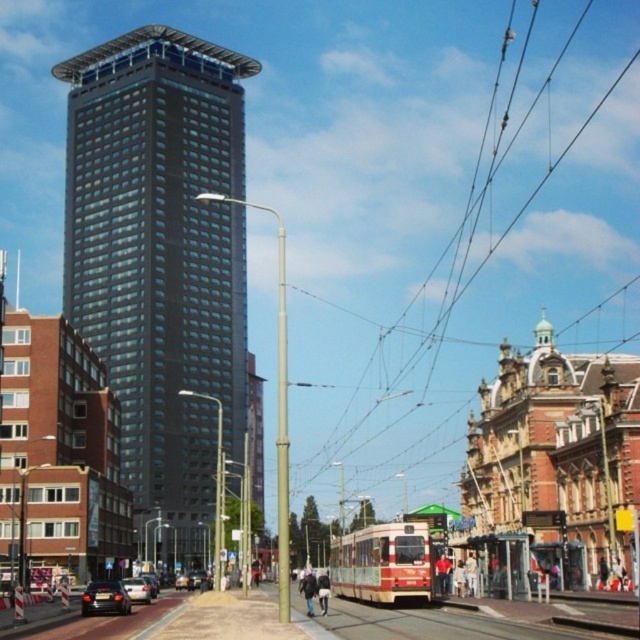
Question: Which object is farther from the camera taking this photo?

Choices:
 (A) silver metallic car at center
 (B) shiny black car at lower left

Answer: (A)

Question: Considering the real-world distances, which object is farthest from the shiny black car at lower left?

Choices:
 (A) matte glass tower at center
 (B) silver metallic car at center

Answer: (A)

Question: Is shiny black car at lower left thinner than silver metallic car at center?

Choices:
 (A) yes
 (B) no

Answer: (B)

Question: Observing the image, what is the correct spatial positioning of matte glass tower at center in reference to shiny black car at lower left?

Choices:
 (A) right
 (B) left

Answer: (B)

Question: Does matte glass tower at center appear on the right side of shiny black car at lower left?

Choices:
 (A) no
 (B) yes

Answer: (A)

Question: Which point appears closest to the camera in this image?

Choices:
 (A) (97, 588)
 (B) (173, 67)
 (C) (148, 592)

Answer: (A)